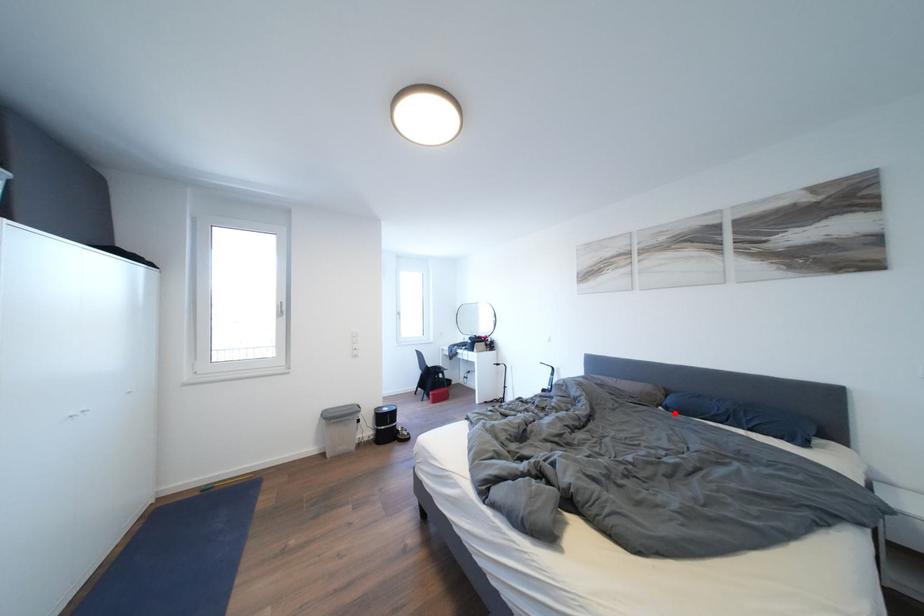
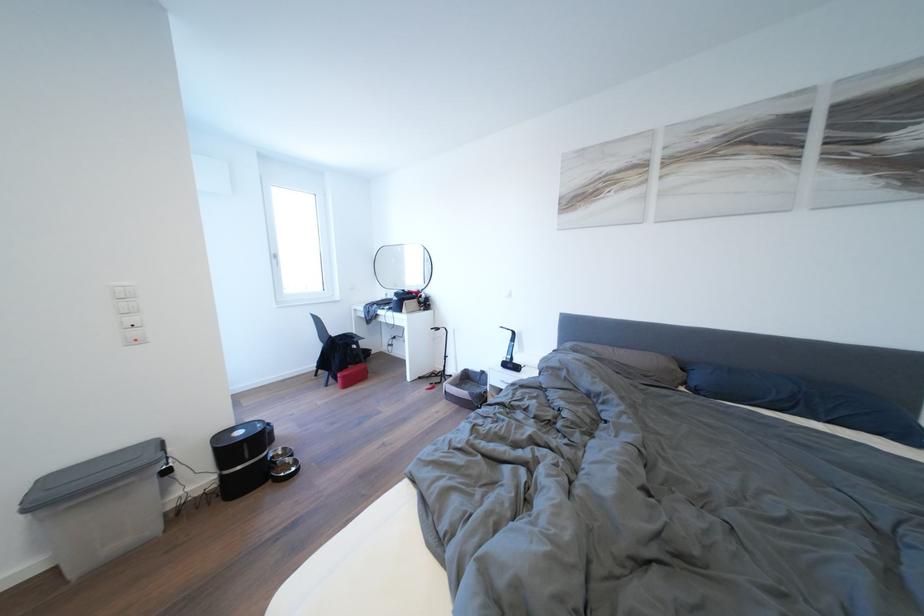
Where in the second image is the point corresponding to the highlighted location from the first image?

(703, 395)